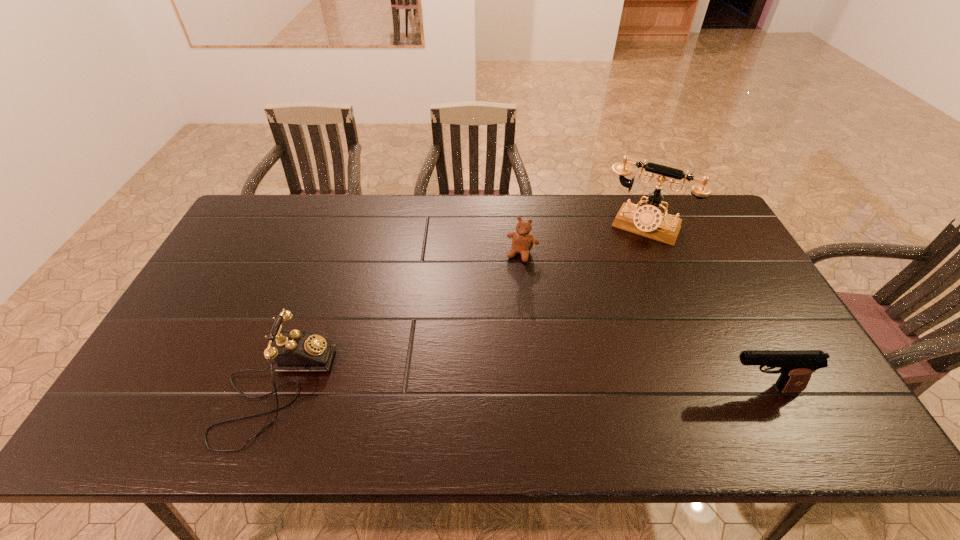
Identify the location of vacant space on the desktop that is between the left telephone and the pistol and is positioned on the face of the teddy bear. The image size is (960, 540). (457, 389).

Image resolution: width=960 pixels, height=540 pixels. What are the coordinates of `free space on the desktop that is between the leftmost object and the pistol and is positioned on the dial of the tallest object` in the screenshot? It's located at (566, 389).